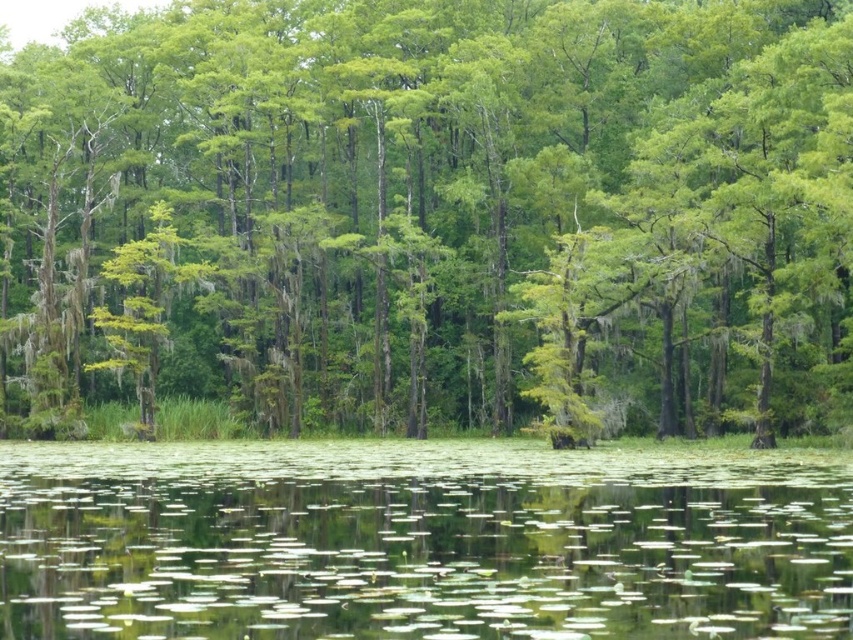
Between green mossy tree at center and green lily pads at center, which one has less height?

Standing shorter between the two is green lily pads at center.

Who is positioned more to the left, green mossy tree at center or green lily pads at center?

From the viewer's perspective, green mossy tree at center appears more on the left side.

Locate an element on the screen. green mossy tree at center is located at coordinates (434, 214).

Where is `green mossy tree at center`? green mossy tree at center is located at coordinates (434, 214).